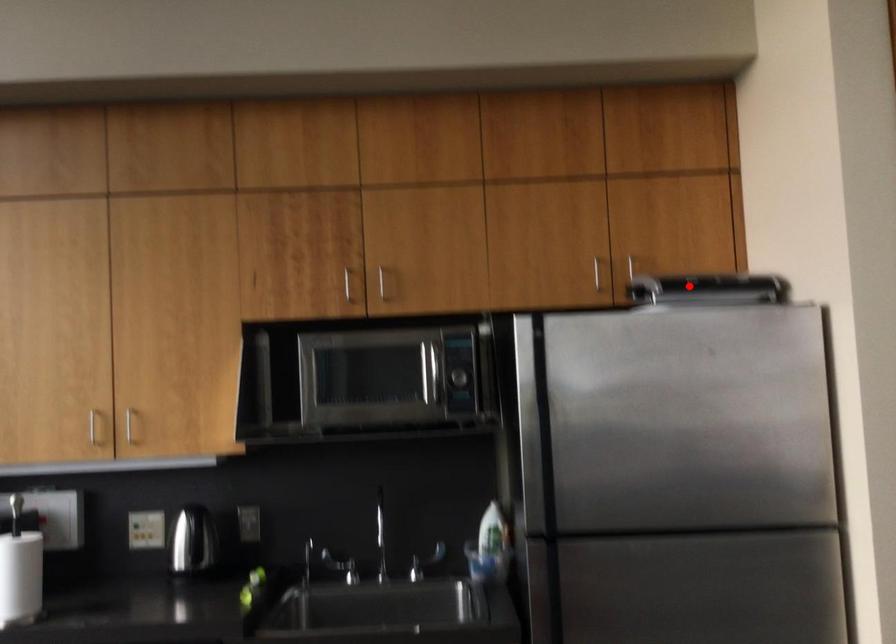
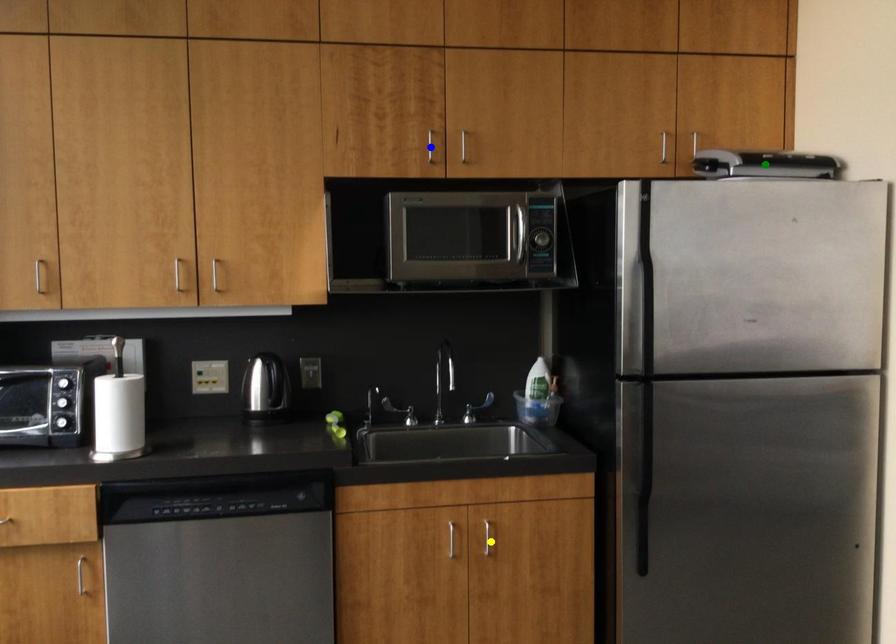
Question: I am providing you with two images of the same scene from different viewpoints. A red point is marked on the first image. You are given multiple points on the second image. Which point in image 2 is actually the same real-world point as the red point in image 1?

Choices:
 (A) yellow point
 (B) blue point
 (C) green point

Answer: (C)